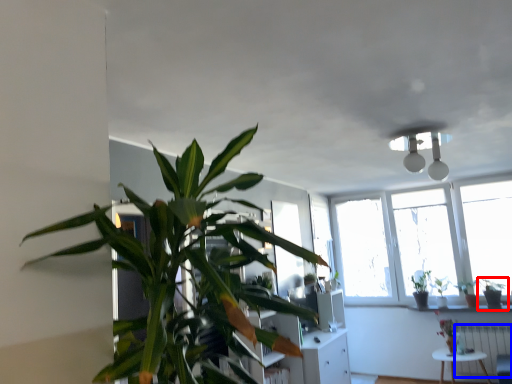
Question: Which object appears farthest to the camera in this image, houseplant (highlighted by a red box) or radiator (highlighted by a blue box)?

Choices:
 (A) houseplant
 (B) radiator

Answer: (A)